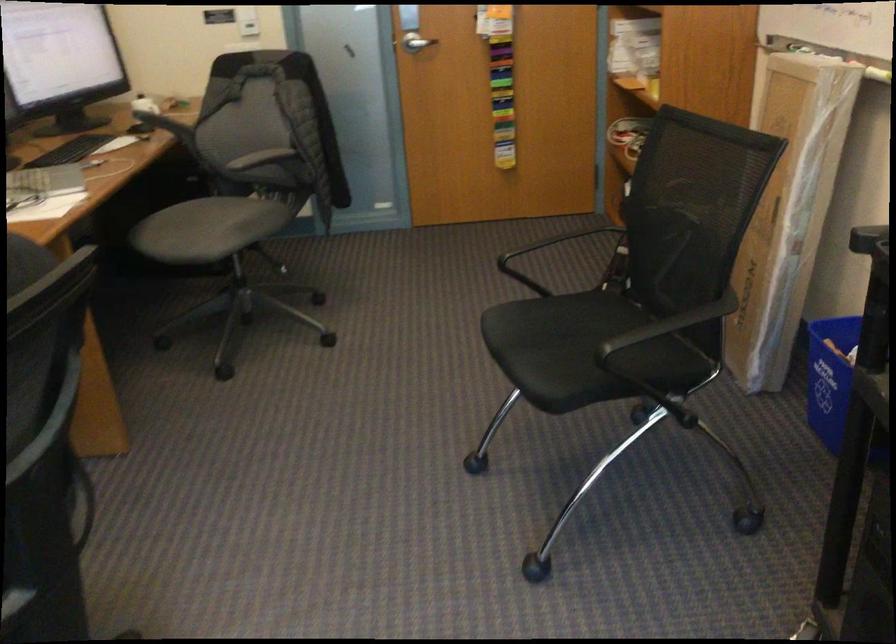
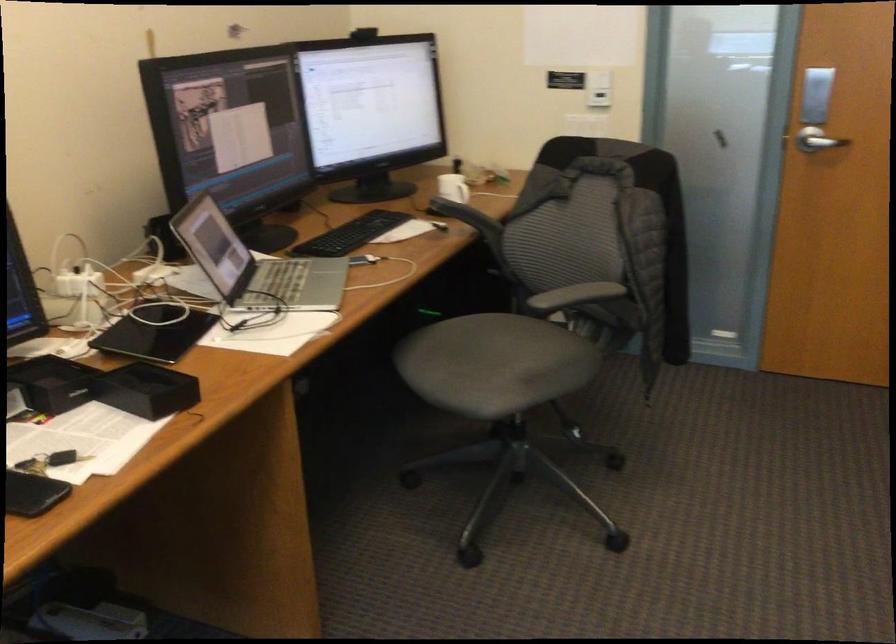
Question: In a continuous first-person perspective shot, in which direction is the camera moving?

Choices:
 (A) Left
 (B) Right
 (C) Forward
 (D) Backward

Answer: (C)